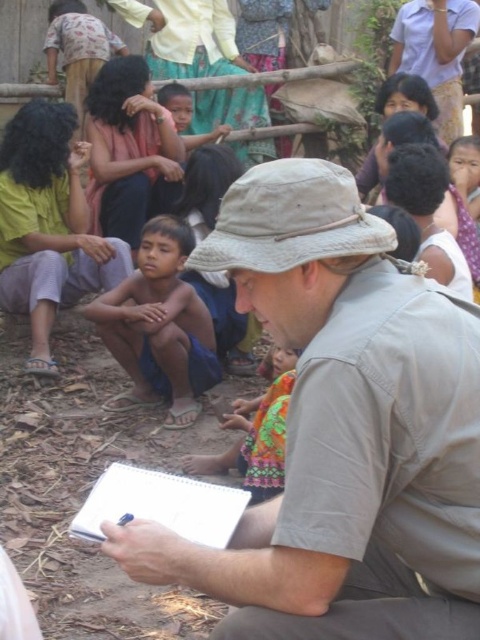
Is white paper clipboard at center below multicolored fabric dress at center?

Yes, white paper clipboard at center is below multicolored fabric dress at center.

Does white paper clipboard at center come in front of multicolored fabric dress at center?

Yes, it is in front of multicolored fabric dress at center.

At what (x,y) coordinates should I click in order to perform the action: click on white paper clipboard at center. Please return your answer as a coordinate pair (x, y). Looking at the image, I should click on (160, 504).

I want to click on white paper clipboard at center, so click(x=160, y=504).

Can you confirm if blue shorts at center is positioned below multicolored fabric dress at center?

No, blue shorts at center is not below multicolored fabric dress at center.

I want to click on blue shorts at center, so click(x=159, y=326).

Does point (166, 312) lie in front of point (245, 477)?

No, (166, 312) is behind (245, 477).

The width and height of the screenshot is (480, 640). I want to click on blue shorts at center, so coord(159,326).

Can you confirm if light green fabric shirt at lower left is thinner than brown skin child at center?

No, light green fabric shirt at lower left is not thinner than brown skin child at center.

Can you confirm if light green fabric shirt at lower left is taller than brown skin child at center?

Yes, light green fabric shirt at lower left is taller than brown skin child at center.

Does point (38, 188) come in front of point (106, 225)?

That is True.

I want to click on light green fabric shirt at lower left, so click(48, 225).